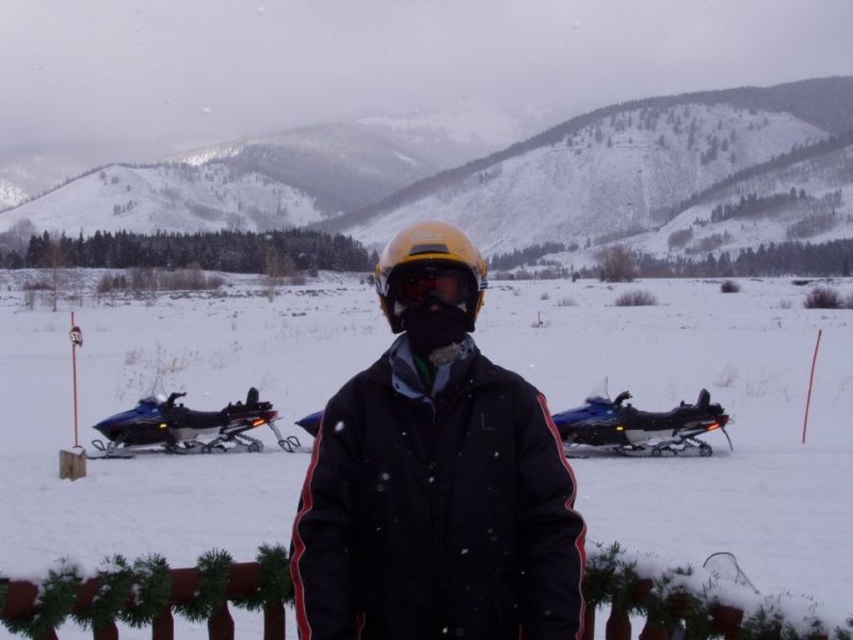
Between matte black jacket at center and blue metallic snowmobile at left, which one is positioned lower?

Positioned lower is blue metallic snowmobile at left.

Is point (433, 620) positioned in front of point (137, 442)?

Yes, point (433, 620) is in front of point (137, 442).

Identify the location of matte black jacket at center. (436, 499).

Identify the location of matte black jacket at center. This screenshot has width=853, height=640. (436, 499).

Is matte black jacket at center taller than yellow matte helmet at center?

Indeed, matte black jacket at center has a greater height compared to yellow matte helmet at center.

Measure the distance between point (x=486, y=534) and camera.

Point (x=486, y=534) is 22.81 meters from camera.

What are the coordinates of `matte black jacket at center` in the screenshot? It's located at (436, 499).

In the scene shown: Does white fluffy snow at center appear over matte yellow goggles at center?

Actually, white fluffy snow at center is below matte yellow goggles at center.

How distant is white fluffy snow at center from matte yellow goggles at center?

white fluffy snow at center and matte yellow goggles at center are 152.49 feet apart from each other.

Identify the location of white fluffy snow at center. This screenshot has height=640, width=853. (706, 433).